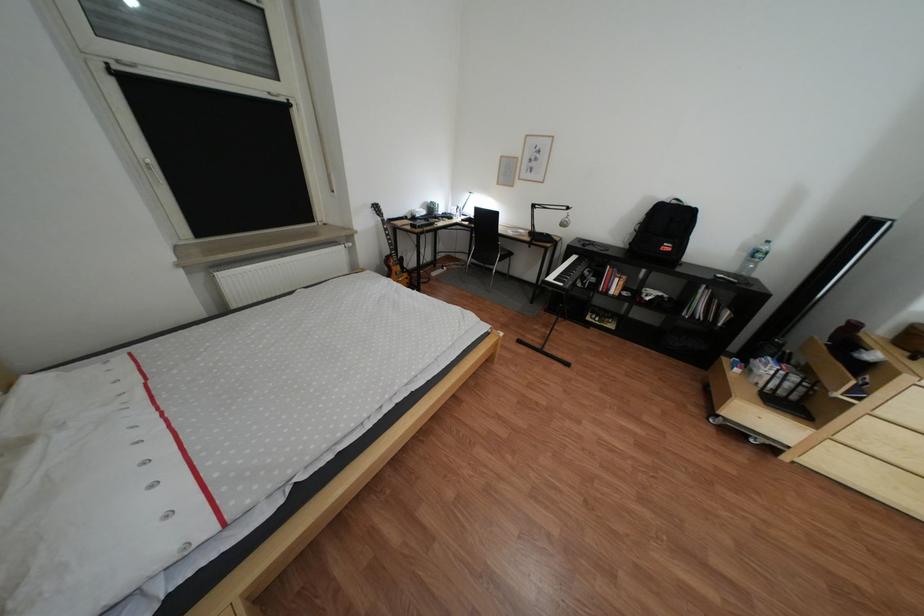
Find the location of a particular element. The height and width of the screenshot is (616, 924). plastic water bottle is located at coordinates (755, 257).